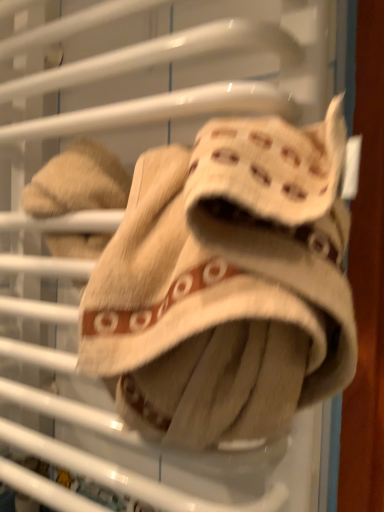
What do you see at coordinates (226, 284) in the screenshot? I see `beige knitted towel at center` at bounding box center [226, 284].

At what (x,y) coordinates should I click in order to perform the action: click on beige knitted towel at center. Please return your answer as a coordinate pair (x, y). The height and width of the screenshot is (512, 384). Looking at the image, I should click on (226, 284).

I want to click on beige knitted towel at center, so click(x=226, y=284).